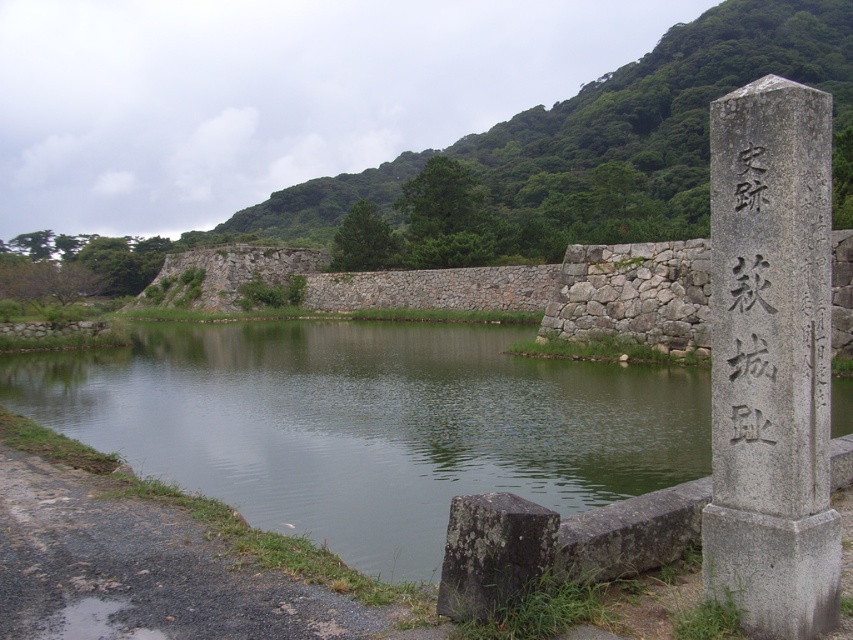
Consider the image. You are standing at the point marked as point (x=369, y=424) in the serene landscape. What do you see directly in front of you?

You see the green stone river at center directly in front of you at point (x=369, y=424).

You are a tour guide leading a group to the gray stone pillar at right and the black stone writing at right. Your group has a 5 feet wide cart. Can the cart pass between the two objects?

The distance between the gray stone pillar at right and the black stone writing at right is 6.15 feet. Since the cart is 5 feet wide, it can pass through the space between them.